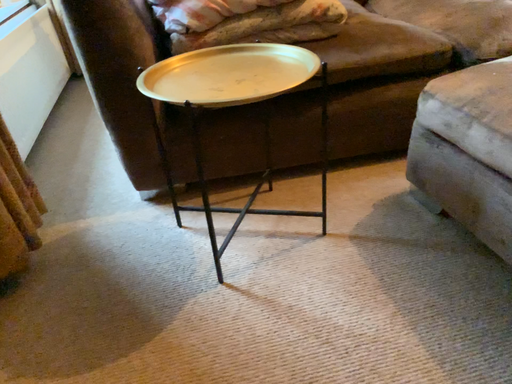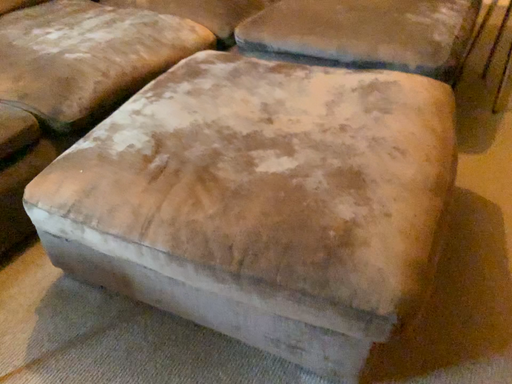
Question: Which way did the camera rotate in the video?

Choices:
 (A) rotated right
 (B) rotated left

Answer: (A)